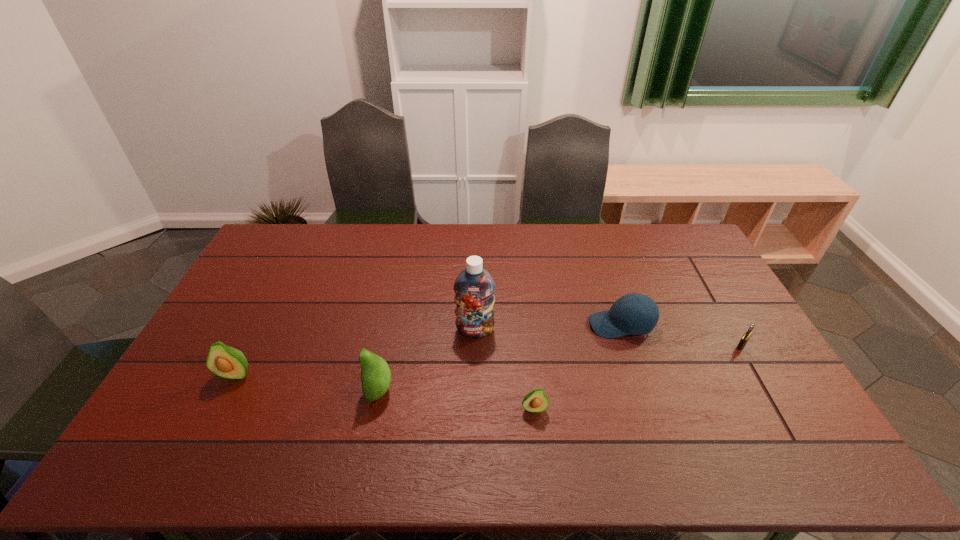
You are a GUI agent. You are given a task and a screenshot of the screen. Output one action in this format:
    pyautogui.click(x=<x>, y=<y>)
    Task: Click on the vacant point located between the fifth object from right to left and the padlock
    This screenshot has height=540, width=960.
    Given the screenshot: What is the action you would take?
    pyautogui.click(x=561, y=368)

Identify the location of vacant region between the padlock and the third object from right to left. (637, 377).

This screenshot has height=540, width=960. Find the location of `empty location between the shampoo and the rightmost avocado`. empty location between the shampoo and the rightmost avocado is located at coordinates (504, 369).

Image resolution: width=960 pixels, height=540 pixels. Find the location of `empty space between the second object from right to left and the second avocado from left to right`. empty space between the second object from right to left and the second avocado from left to right is located at coordinates (500, 358).

Identify which object is the fourth nearest to the leftmost avocado. Please provide its 2D coordinates. Your answer should be formatted as a tuple, i.e. [(x, y)], where the tuple contains the x and y coordinates of a point satisfying the conditions above.

[(619, 321)]

Point out which object is positioned as the second nearest to the rightmost avocado. Please provide its 2D coordinates. Your answer should be formatted as a tuple, i.e. [(x, y)], where the tuple contains the x and y coordinates of a point satisfying the conditions above.

[(619, 321)]

What are the coordinates of `avocado that is the second closest to the second avocado from right to left` in the screenshot? It's located at (535, 401).

Identify which avocado is the second closest to the shortest avocado. Please provide its 2D coordinates. Your answer should be formatted as a tuple, i.e. [(x, y)], where the tuple contains the x and y coordinates of a point satisfying the conditions above.

[(225, 361)]

Find the location of a particular element. free region that satisfies the following two spatial constraints: 1. on the front-facing side of the baseball cap; 2. on the cut side of the leftmost object is located at coordinates (637, 374).

Identify the location of blank space that satisfies the following two spatial constraints: 1. on the front label of the third object from left to right; 2. on the cut side of the fifth object from right to left. (474, 390).